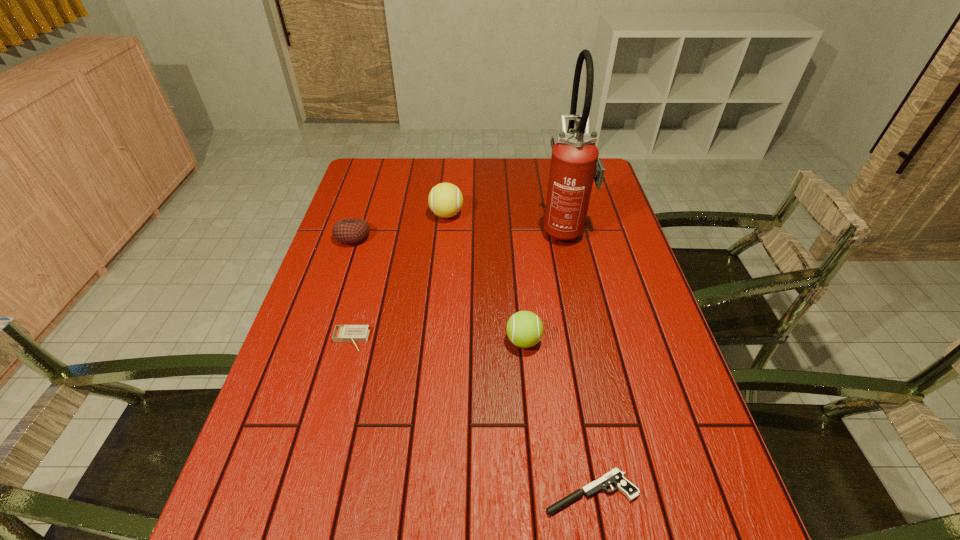
You are a GUI agent. You are given a task and a screenshot of the screen. Output one action in this format:
    pyautogui.click(x=<x>, y=<y>)
    Task: Click on the matchbox positioned at the left edge
    The width and height of the screenshot is (960, 540).
    Given the screenshot: What is the action you would take?
    pyautogui.click(x=342, y=333)

Locate an element on the screen. The height and width of the screenshot is (540, 960). object situated at the right edge is located at coordinates 575,164.

At what (x,y) coordinates should I click in order to perform the action: click on free space at the far edge of the desktop. Please return your answer as a coordinate pair (x, y). Image resolution: width=960 pixels, height=540 pixels. Looking at the image, I should click on (466, 171).

Find the location of a particular element. vacant space at the left edge is located at coordinates (328, 272).

Where is `vacant space at the right edge`? The height and width of the screenshot is (540, 960). vacant space at the right edge is located at coordinates (611, 275).

Locate an element on the screen. This screenshot has height=540, width=960. free spot between the tallest object and the farther tennis ball is located at coordinates (506, 221).

Identify the location of vacant area that lies between the fire extinguisher and the left tennis ball. The width and height of the screenshot is (960, 540). (506, 221).

In order to click on free space between the pistol and the third shortest object in this screenshot , I will do `click(472, 364)`.

Find the location of a particular element. free space between the shortest object and the right tennis ball is located at coordinates (557, 416).

Locate an element on the screen. The height and width of the screenshot is (540, 960). vacant area that lies between the fire extinguisher and the beanbag is located at coordinates (459, 233).